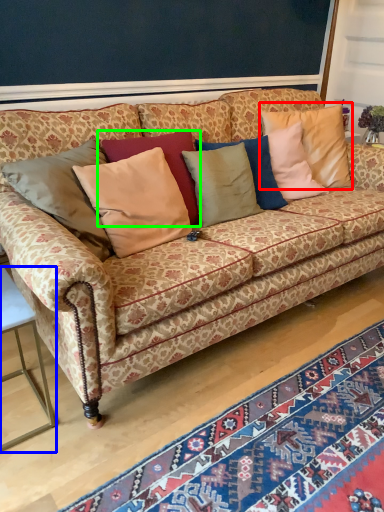
Question: Which is nearer to the pillow (highlighted by a red box)? table (highlighted by a blue box) or pillow (highlighted by a green box).

Choices:
 (A) table
 (B) pillow

Answer: (B)